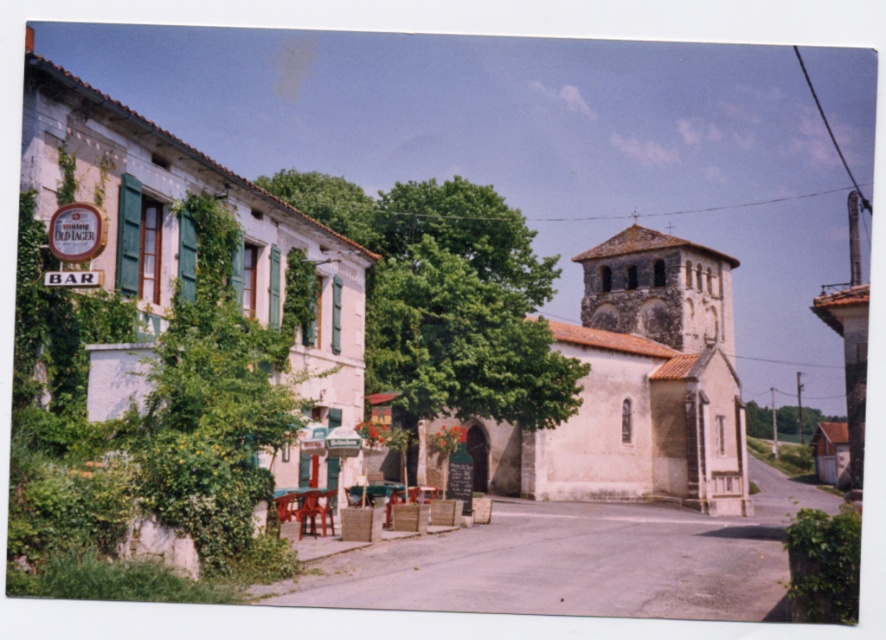
Question: Does wooden table at center have a smaller size compared to wooden chair at center?

Choices:
 (A) yes
 (B) no

Answer: (B)

Question: Is green leafy tree at center further to camera compared to wooden table at center?

Choices:
 (A) yes
 (B) no

Answer: (A)

Question: Which of the following is the farthest from the observer?

Choices:
 (A) wooden table at center
 (B) green leafy tree at center
 (C) green leafy tree at right
 (D) wooden chair at center

Answer: (C)

Question: Which point is closer to the camera taking this photo?

Choices:
 (A) (364, 198)
 (B) (298, 518)
 (C) (771, 433)
 (D) (309, 497)

Answer: (B)

Question: Observing the image, what is the correct spatial positioning of green leafy tree at center in reference to wooden table at center?

Choices:
 (A) left
 (B) right

Answer: (A)

Question: Considering the real-world distances, which object is closest to the wooden table at center?

Choices:
 (A) wooden chair at center
 (B) green leafy tree at right

Answer: (A)